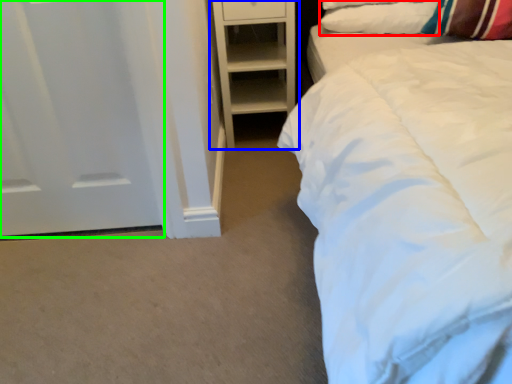
Question: Which is farther away from pillow (highlighted by a red box)? shelf (highlighted by a blue box) or door (highlighted by a green box)?

Choices:
 (A) shelf
 (B) door

Answer: (B)